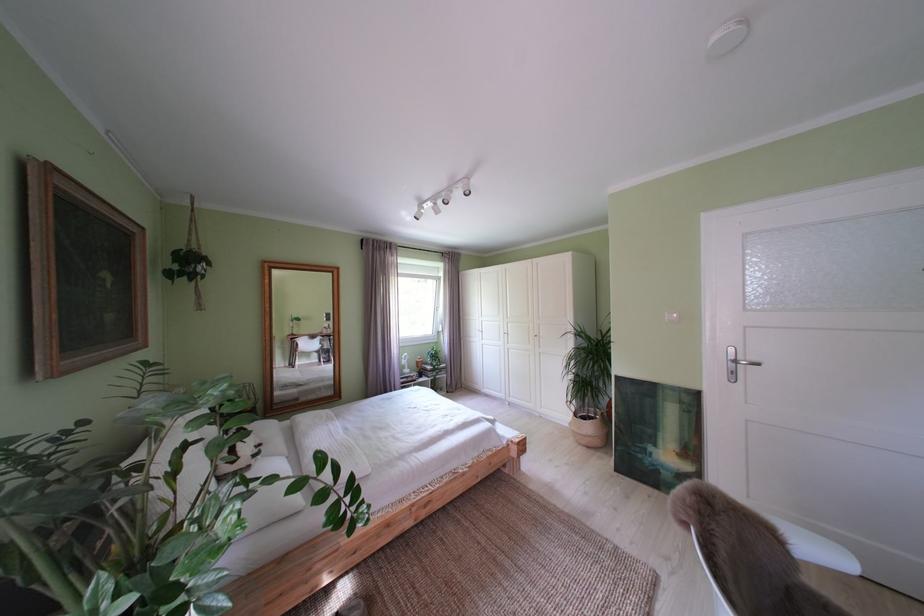
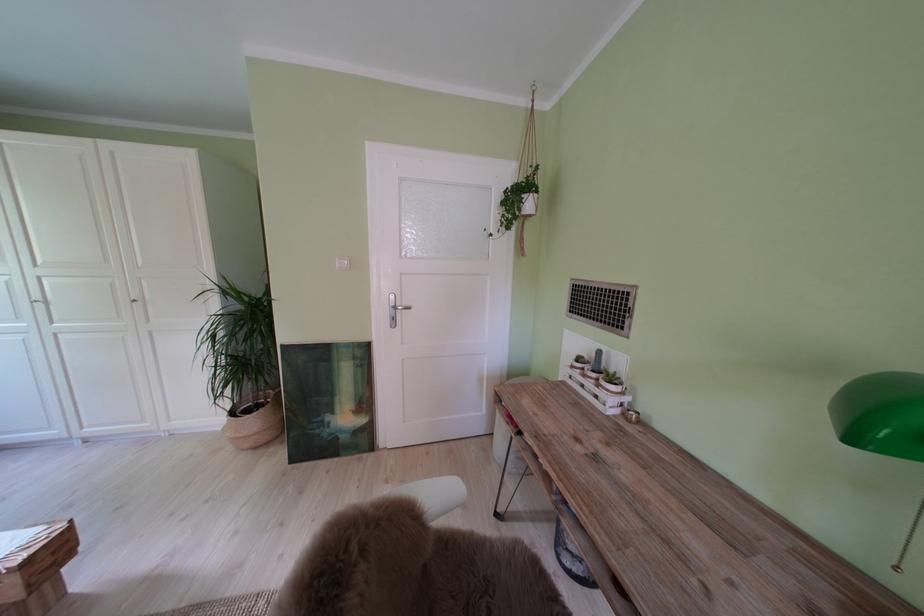
In the second image, find the point that corresponds to (x=650, y=461) in the first image.

(329, 437)